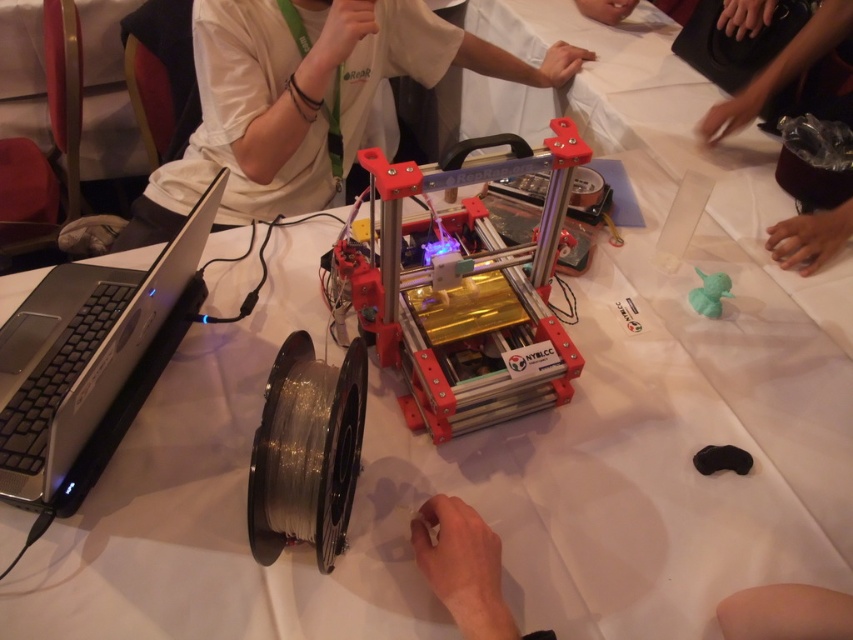
Question: Based on their relative distances, which object is farther from the metallic red printer at center?

Choices:
 (A) white cotton shirt at upper center
 (B) matte green plastic toy at center-right

Answer: (A)

Question: Can you confirm if metallic red printer at center is wider than white matte hand at lower center?

Choices:
 (A) no
 (B) yes

Answer: (B)

Question: Can you confirm if white cotton shirt at upper center is thinner than white matte hand at lower center?

Choices:
 (A) no
 (B) yes

Answer: (A)

Question: Which object appears farthest from the camera in this image?

Choices:
 (A) smooth plastic cup at upper right
 (B) white cotton shirt at upper center

Answer: (A)

Question: Which of the following is the closest to the observer?

Choices:
 (A) silver/black plastic laptop at left
 (B) matte green plastic toy at center-right
 (C) metallic red printer at center

Answer: (A)

Question: Is metallic red printer at center smaller than matte green plastic toy at center-right?

Choices:
 (A) yes
 (B) no

Answer: (B)